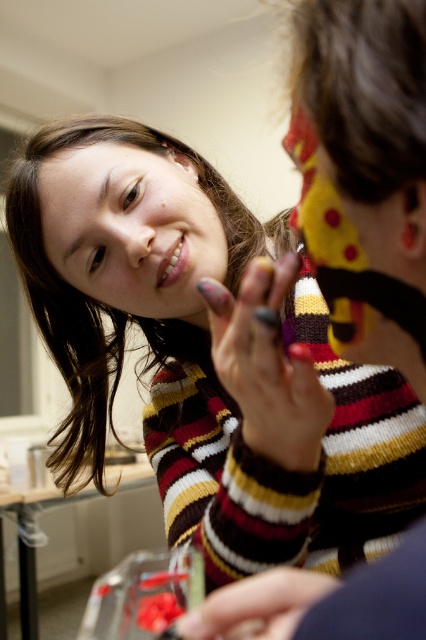
You are a photographer trying to capture a close shot of the matte skin face at upper left and the matte white lipstick at lower center. Given that your camera has a maximum focus range of 3 inches, will both objects be in focus?

The matte skin face at upper left and matte white lipstick at lower center are 2.96 inches apart from each other, so yes, both objects will be in focus as the distance between them is within the camera maximum focus range of 3 inches.

You are a makeup artist observing the scene. You need to apply lipstick to the matte skin face at upper left. Given that the matte white lipstick at lower center is currently in your hand, can you reach it without moving your position?

The matte skin face at upper left is taller than the matte white lipstick at lower center, so yes, you can reach the matte white lipstick at lower center as it is positioned lower and within your reach.